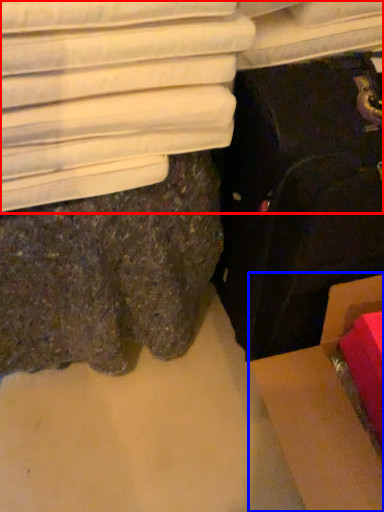
Question: Which of the following is the farthest to the observer, furniture (highlighted by a red box) or cardboard box (highlighted by a blue box)?

Choices:
 (A) furniture
 (B) cardboard box

Answer: (B)